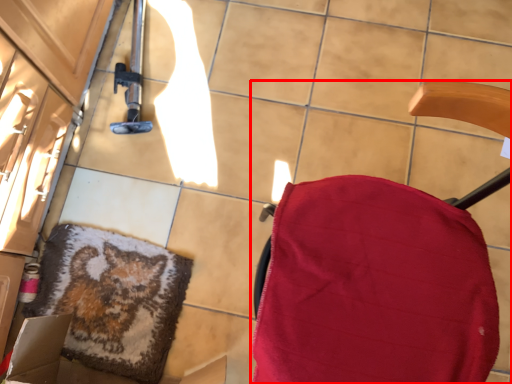
Question: From the image's perspective, where is furniture (annotated by the red box) located in relation to mat in the image?

Choices:
 (A) above
 (B) below

Answer: (A)